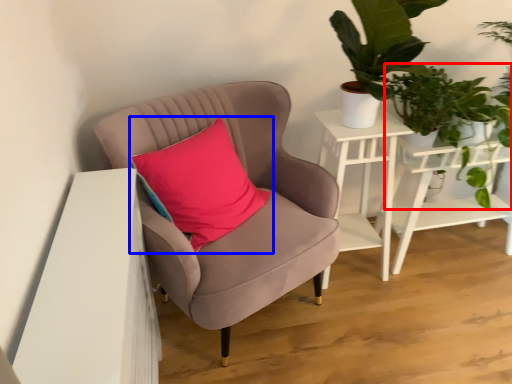
Question: Which of the following is the farthest to the observer, vegetation (highlighted by a red box) or pillow (highlighted by a blue box)?

Choices:
 (A) vegetation
 (B) pillow

Answer: (A)